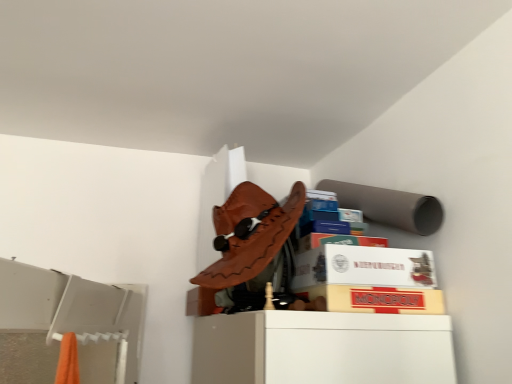
The width and height of the screenshot is (512, 384). Find the location of `white cardboard box at upper center, the second cardboard box when ordered from bottom to top`. white cardboard box at upper center, the second cardboard box when ordered from bottom to top is located at coordinates (364, 267).

What do you see at coordinates (364, 267) in the screenshot? This screenshot has height=384, width=512. I see `white cardboard box at upper center, the second cardboard box when ordered from bottom to top` at bounding box center [364, 267].

Identify the location of matte yellow monopoly box at center, the second cardboard box from the top. (375, 299).

This screenshot has width=512, height=384. What do you see at coordinates (375, 299) in the screenshot?
I see `matte yellow monopoly box at center, the 1th cardboard box positioned from the bottom` at bounding box center [375, 299].

What is the approximate height of matte yellow monopoly box at center, the second cardboard box from the top?

matte yellow monopoly box at center, the second cardboard box from the top, is 2.06 inches tall.

Where is `white cardboard box at upper center, the second cardboard box when ordered from bottom to top`? The width and height of the screenshot is (512, 384). white cardboard box at upper center, the second cardboard box when ordered from bottom to top is located at coordinates (364, 267).

Does matte yellow monopoly box at center, the second cardboard box from the top, appear on the right side of white cardboard box at upper center, the 1th cardboard box from the top?

Indeed, matte yellow monopoly box at center, the second cardboard box from the top, is positioned on the right side of white cardboard box at upper center, the 1th cardboard box from the top.

Consider the image. Which object is more forward, matte yellow monopoly box at center, the 1th cardboard box positioned from the bottom, or white cardboard box at upper center, the 1th cardboard box from the top?

matte yellow monopoly box at center, the 1th cardboard box positioned from the bottom, is more forward.

Does point (393, 310) appear closer or farther from the camera than point (430, 260)?

Point (393, 310) is positioned closer to the camera compared to point (430, 260).

From the image's perspective, which one is positioned higher, matte yellow monopoly box at center, the 1th cardboard box positioned from the bottom, or white cardboard box at upper center, the second cardboard box when ordered from bottom to top?

white cardboard box at upper center, the second cardboard box when ordered from bottom to top, is shown above in the image.

In the scene shown: From a real-world perspective, is matte yellow monopoly box at center, the second cardboard box from the top, over white cardboard box at upper center, the 1th cardboard box from the top?

No.

Between matte yellow monopoly box at center, the second cardboard box from the top, and white cardboard box at upper center, the second cardboard box when ordered from bottom to top, which one has smaller width?

With smaller width is white cardboard box at upper center, the second cardboard box when ordered from bottom to top.

Considering the relative sizes of matte yellow monopoly box at center, the 1th cardboard box positioned from the bottom, and white cardboard box at upper center, the second cardboard box when ordered from bottom to top, in the image provided, is matte yellow monopoly box at center, the 1th cardboard box positioned from the bottom, taller than white cardboard box at upper center, the second cardboard box when ordered from bottom to top,?

In fact, matte yellow monopoly box at center, the 1th cardboard box positioned from the bottom, may be shorter than white cardboard box at upper center, the second cardboard box when ordered from bottom to top.

Can you confirm if matte yellow monopoly box at center, the 1th cardboard box positioned from the bottom, is smaller than white cardboard box at upper center, the 1th cardboard box from the top?

Correct, matte yellow monopoly box at center, the 1th cardboard box positioned from the bottom, occupies less space than white cardboard box at upper center, the 1th cardboard box from the top.

Is matte yellow monopoly box at center, the second cardboard box from the top, located outside white cardboard box at upper center, the 1th cardboard box from the top?

Yes.

Would you consider matte yellow monopoly box at center, the second cardboard box from the top, to be distant from white cardboard box at upper center, the second cardboard box when ordered from bottom to top?

They are positioned close to each other.

Is matte yellow monopoly box at center, the 1th cardboard box positioned from the bottom, facing away from white cardboard box at upper center, the 1th cardboard box from the top?

matte yellow monopoly box at center, the 1th cardboard box positioned from the bottom, does not have its back to white cardboard box at upper center, the 1th cardboard box from the top.

How many degrees apart are the facing directions of matte yellow monopoly box at center, the second cardboard box from the top, and white cardboard box at upper center, the second cardboard box when ordered from bottom to top?

The angular difference between matte yellow monopoly box at center, the second cardboard box from the top, and white cardboard box at upper center, the second cardboard box when ordered from bottom to top, is 0.00112 degrees.

Based on the photo, measure the distance from matte yellow monopoly box at center, the 1th cardboard box positioned from the bottom, to white cardboard box at upper center, the second cardboard box when ordered from bottom to top.

matte yellow monopoly box at center, the 1th cardboard box positioned from the bottom, and white cardboard box at upper center, the second cardboard box when ordered from bottom to top, are 1.56 inches apart from each other.

Locate an element on the screen. The height and width of the screenshot is (384, 512). cardboard box located below the white cardboard box at upper center, the 1th cardboard box from the top (from the image's perspective) is located at coordinates (375, 299).

Considering the relative positions of white cardboard box at upper center, the second cardboard box when ordered from bottom to top, and matte yellow monopoly box at center, the second cardboard box from the top, in the image provided, is white cardboard box at upper center, the second cardboard box when ordered from bottom to top, to the left of matte yellow monopoly box at center, the second cardboard box from the top, from the viewer's perspective?

Yes, white cardboard box at upper center, the second cardboard box when ordered from bottom to top, is to the left of matte yellow monopoly box at center, the second cardboard box from the top.

Relative to matte yellow monopoly box at center, the second cardboard box from the top, is white cardboard box at upper center, the 1th cardboard box from the top, in front or behind?

white cardboard box at upper center, the 1th cardboard box from the top, is behind matte yellow monopoly box at center, the second cardboard box from the top.

Does point (407, 266) come farther from viewer compared to point (339, 308)?

Yes.

From the image's perspective, which one is positioned higher, white cardboard box at upper center, the 1th cardboard box from the top, or matte yellow monopoly box at center, the second cardboard box from the top?

white cardboard box at upper center, the 1th cardboard box from the top, is shown above in the image.

From a real-world perspective, between white cardboard box at upper center, the 1th cardboard box from the top, and matte yellow monopoly box at center, the second cardboard box from the top, who is vertically lower?

From a 3D spatial view, matte yellow monopoly box at center, the second cardboard box from the top, is below.

Which object is wider, white cardboard box at upper center, the second cardboard box when ordered from bottom to top, or matte yellow monopoly box at center, the 1th cardboard box positioned from the bottom?

Wider between the two is matte yellow monopoly box at center, the 1th cardboard box positioned from the bottom.

Considering the sizes of objects white cardboard box at upper center, the second cardboard box when ordered from bottom to top, and matte yellow monopoly box at center, the second cardboard box from the top, in the image provided, who is taller, white cardboard box at upper center, the second cardboard box when ordered from bottom to top, or matte yellow monopoly box at center, the second cardboard box from the top,?

white cardboard box at upper center, the second cardboard box when ordered from bottom to top.

Which of these two, white cardboard box at upper center, the 1th cardboard box from the top, or matte yellow monopoly box at center, the second cardboard box from the top, is bigger?

With larger size is white cardboard box at upper center, the 1th cardboard box from the top.

Consider the image. Which is correct: white cardboard box at upper center, the 1th cardboard box from the top, is inside matte yellow monopoly box at center, the second cardboard box from the top, or outside of it?

white cardboard box at upper center, the 1th cardboard box from the top, is spatially situated outside matte yellow monopoly box at center, the second cardboard box from the top.

Is white cardboard box at upper center, the 1th cardboard box from the top, placed right next to matte yellow monopoly box at center, the 1th cardboard box positioned from the bottom?

Yes, white cardboard box at upper center, the 1th cardboard box from the top, is right next to matte yellow monopoly box at center, the 1th cardboard box positioned from the bottom, and making contact.

Is white cardboard box at upper center, the second cardboard box when ordered from bottom to top, looking in the opposite direction of matte yellow monopoly box at center, the 1th cardboard box positioned from the bottom?

white cardboard box at upper center, the second cardboard box when ordered from bottom to top, is not turned away from matte yellow monopoly box at center, the 1th cardboard box positioned from the bottom.

Identify the location of cardboard box above the matte yellow monopoly box at center, the 1th cardboard box positioned from the bottom (from a real-world perspective). Image resolution: width=512 pixels, height=384 pixels. (364, 267).

Identify the location of cardboard box that appears above the matte yellow monopoly box at center, the second cardboard box from the top (from the image's perspective). (364, 267).

The height and width of the screenshot is (384, 512). I want to click on cardboard box on the right of the white cardboard box at upper center, the second cardboard box when ordered from bottom to top, so click(x=375, y=299).